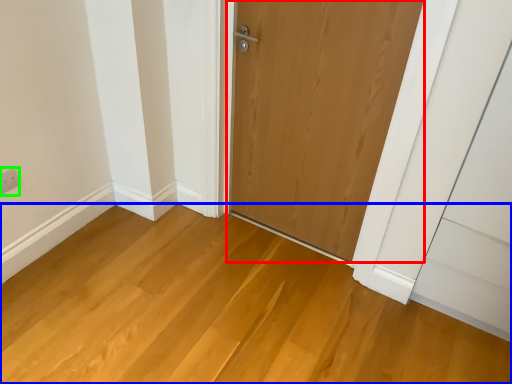
Question: Considering the real-world distances, which object is closest to door (highlighted by a red box)? plain (highlighted by a blue box) or electric outlet (highlighted by a green box).

Choices:
 (A) plain
 (B) electric outlet

Answer: (A)